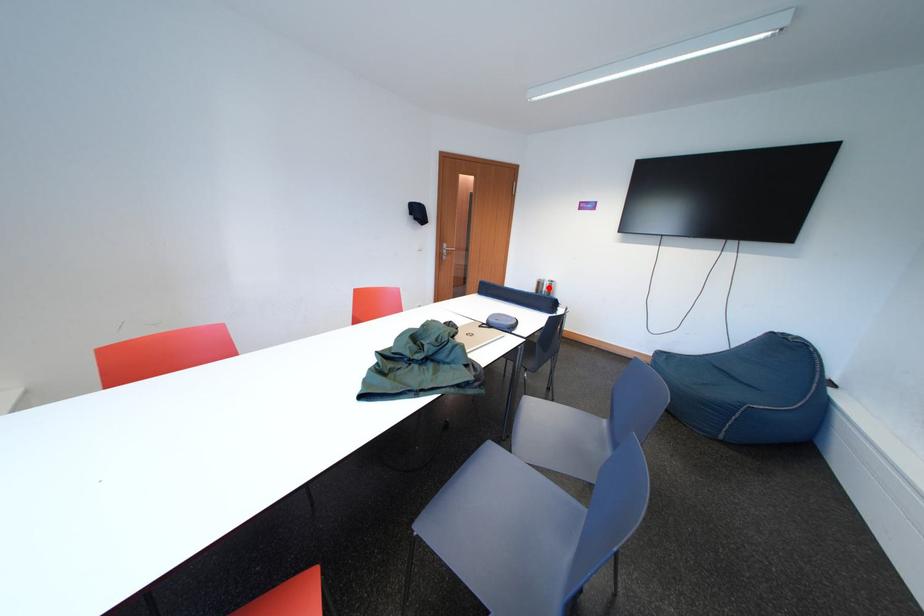
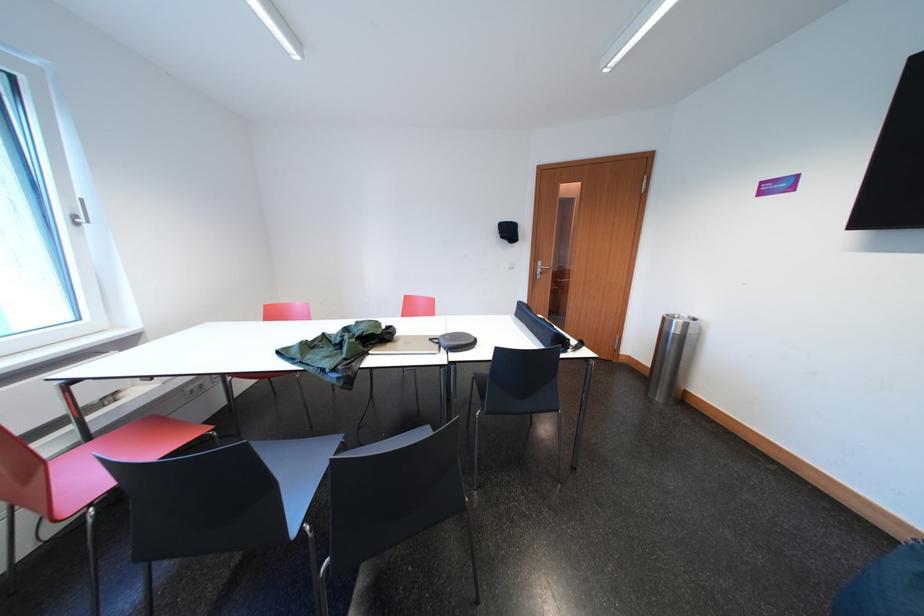
The point at the highlighted location is marked in the first image. Where is the corresponding point in the second image?

(675, 325)